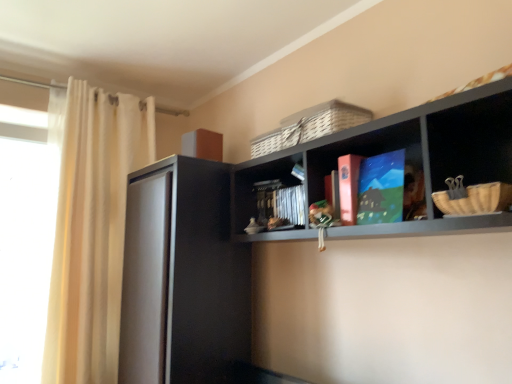
Where is `vacant region above transparent glass window at left (from a real-world perspective)`? The width and height of the screenshot is (512, 384). vacant region above transparent glass window at left (from a real-world perspective) is located at coordinates (30, 112).